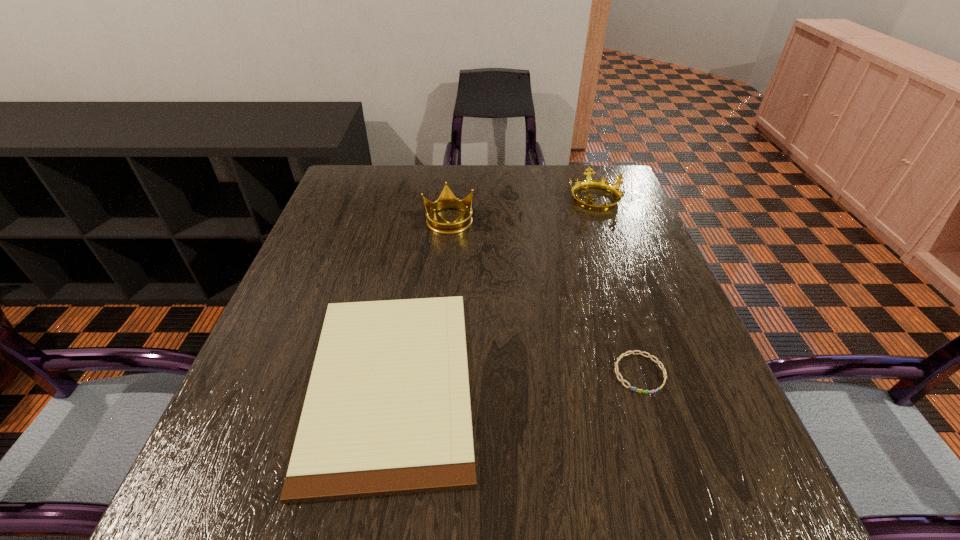
In order to click on object that is at the near edge in this screenshot , I will do `click(387, 411)`.

Find the location of a particular element. This screenshot has width=960, height=540. object located in the left edge section of the desktop is located at coordinates (387, 411).

Find the location of `crown located in the right edge section of the desktop`. crown located in the right edge section of the desktop is located at coordinates (588, 182).

Where is `bracelet situated at the right edge`? This screenshot has width=960, height=540. bracelet situated at the right edge is located at coordinates (631, 352).

At what (x,y) coordinates should I click in order to perform the action: click on object present at the near left corner. Please return your answer as a coordinate pair (x, y). Looking at the image, I should click on (387, 411).

At what (x,y) coordinates should I click in order to perform the action: click on object that is at the far right corner. Please return your answer as a coordinate pair (x, y). Image resolution: width=960 pixels, height=540 pixels. Looking at the image, I should click on (588, 182).

This screenshot has height=540, width=960. What are the coordinates of `free space at the far edge of the desktop` in the screenshot? It's located at (560, 201).

This screenshot has height=540, width=960. Find the location of `vacant space at the near edge of the desktop`. vacant space at the near edge of the desktop is located at coordinates (646, 489).

Find the location of a particular element. This screenshot has width=960, height=540. free space at the left edge is located at coordinates (372, 234).

This screenshot has width=960, height=540. I want to click on vacant area at the right edge of the desktop, so (x=622, y=339).